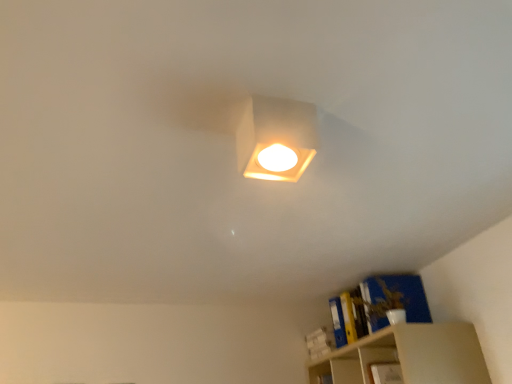
This screenshot has height=384, width=512. Describe the element at coordinates (276, 138) in the screenshot. I see `matte white square light at center` at that location.

The height and width of the screenshot is (384, 512). I want to click on matte white square light at center, so click(276, 138).

In order to face matte white square light at center, should I rotate leftwards or rightwards?

Turn right by 3.198 degrees to look at matte white square light at center.

Where is `matte white square light at center`? This screenshot has height=384, width=512. matte white square light at center is located at coordinates (276, 138).